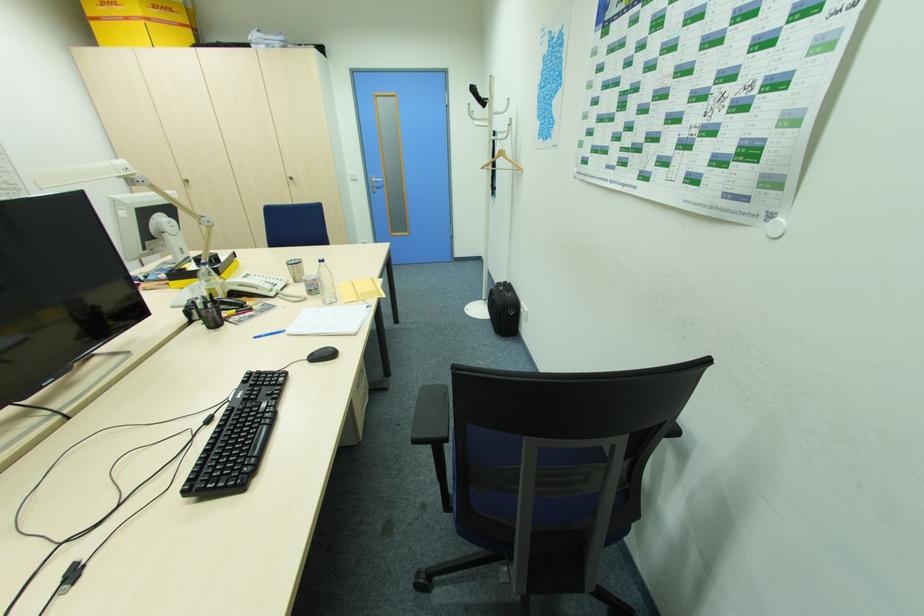
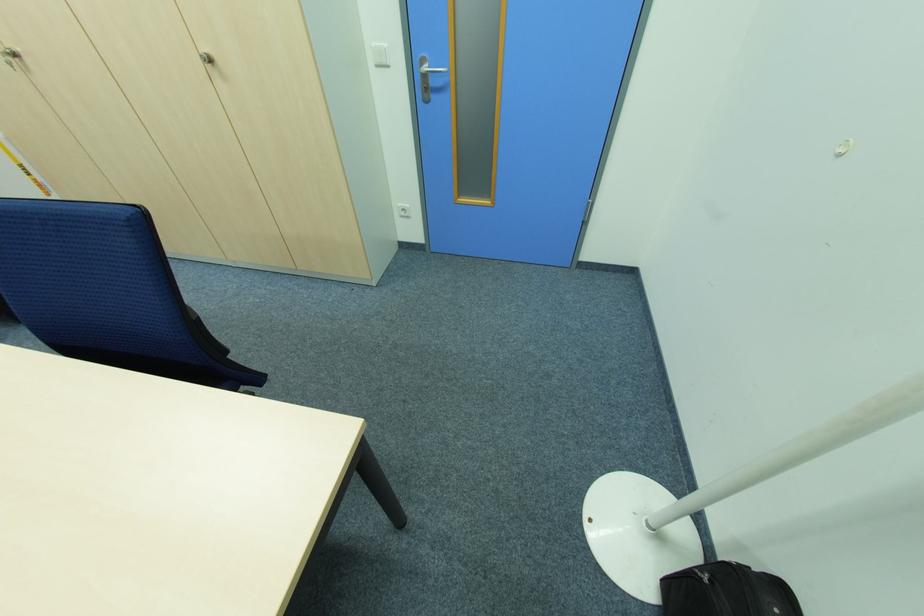
Question: I am providing you with two images of the same scene from different viewpoints. After the viewpoint changes to image2, which objects are now occluded?

Choices:
 (A) silver cabinet knob
 (B) black bag
 (C) silver door handle
 (D) none of these

Answer: (D)